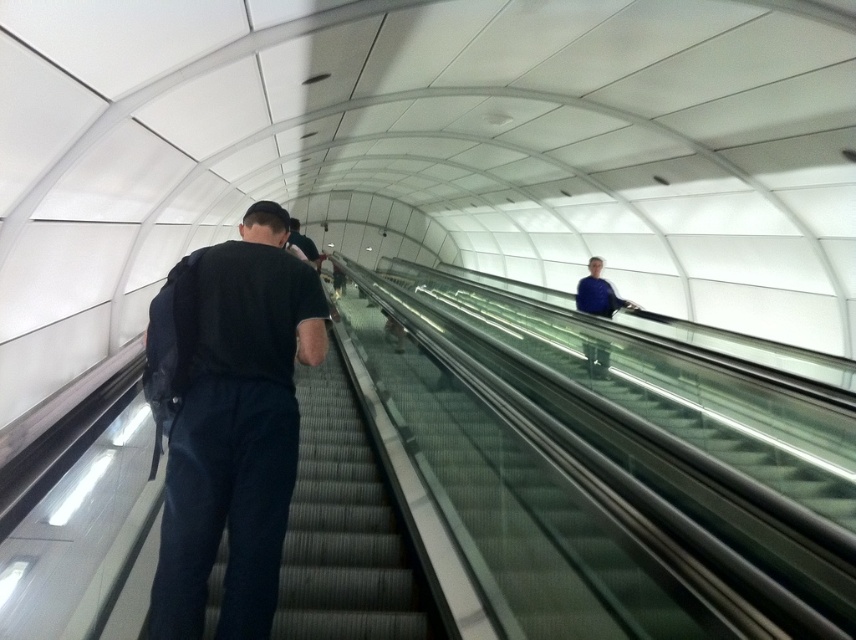
Question: Is black fabric backpack at left to the left of blue fabric jacket at upper center from the viewer's perspective?

Choices:
 (A) no
 (B) yes

Answer: (B)

Question: Which object is positioned farthest from the black fabric backpack at left?

Choices:
 (A) blue fabric jacket at upper center
 (B) black fabric stairs at center

Answer: (A)

Question: Estimate the real-world distances between objects in this image. Which object is closer to the black fabric stairs at center?

Choices:
 (A) black fabric backpack at left
 (B) blue fabric jacket at upper center

Answer: (A)

Question: Does black fabric backpack at left appear on the left side of blue fabric jacket at upper center?

Choices:
 (A) yes
 (B) no

Answer: (A)

Question: Is black fabric backpack at left bigger than black fabric stairs at center?

Choices:
 (A) no
 (B) yes

Answer: (A)

Question: Which of the following is the closest to the observer?

Choices:
 (A) (251, 589)
 (B) (611, 305)

Answer: (A)